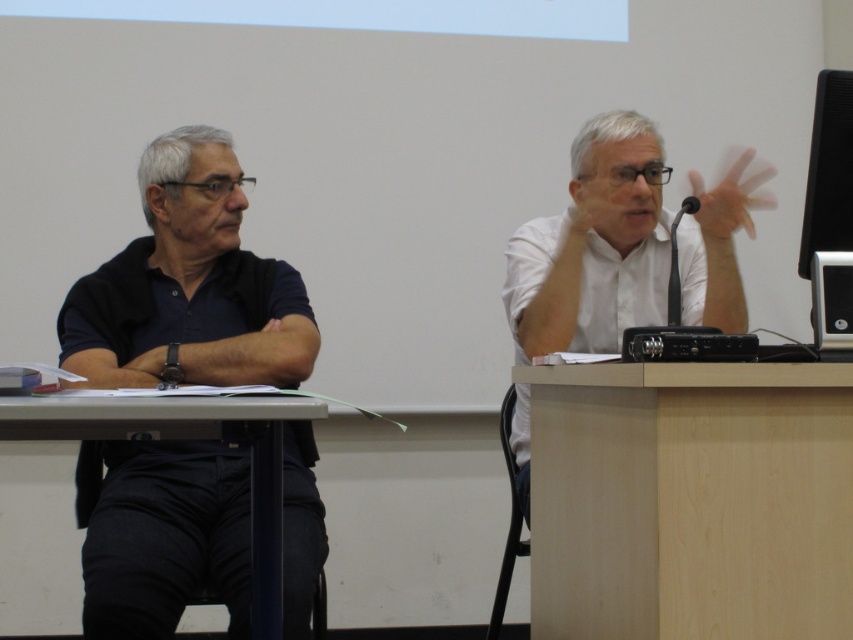
You are standing in the conference room and want to place a 10 cm tall object on the light brown wood table at right. However, there is a white glossy shirt at upper right nearby. Based on their positions, will the object be visible from your current viewpoint?

The light brown wood table at right is closer to the viewer than the white glossy shirt at upper right, so placing a 10 cm tall object on the table would likely make it visible from your current viewpoint as it is positioned closer to you than the shirt.

You are an observer sitting at the back of the room. You notice the white glossy shirt at upper right and the white matte hand at upper right. Which object is positioned lower in the image?

The white glossy shirt at upper right is located below the white matte hand at upper right, so the white glossy shirt at upper right is positioned lower in the image.